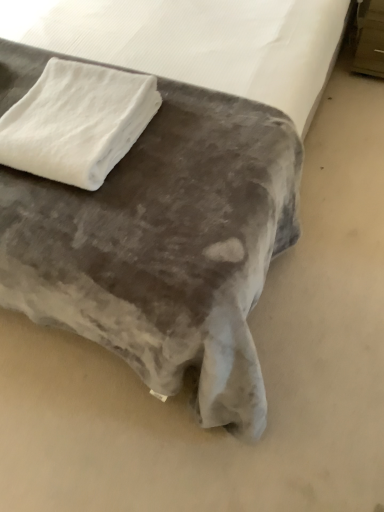
At what (x,y) coordinates should I click in order to perform the action: click on vacant space in front of white soft towel at upper left. Please return your answer as a coordinate pair (x, y). Looking at the image, I should click on (97, 218).